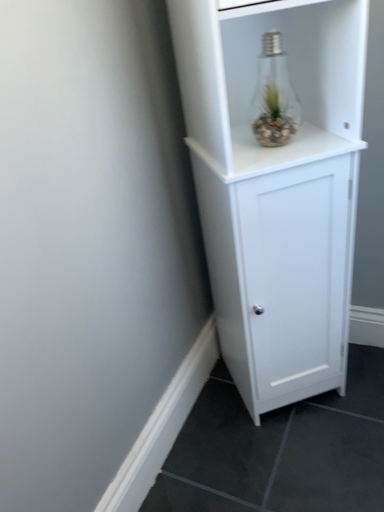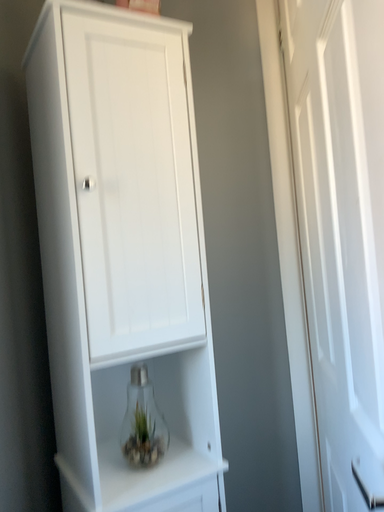
Question: Which way did the camera rotate in the video?

Choices:
 (A) rotated left
 (B) rotated right

Answer: (B)